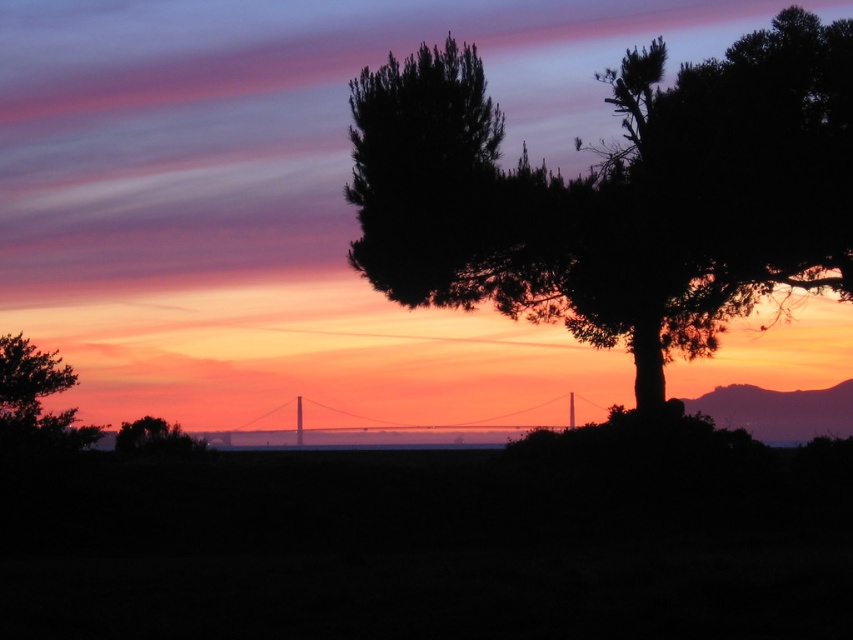
You are an artist sketching the sunset scene. You need to place the black silhouetted tree at upper right and the green matte tree at lower left in your drawing. According to the scene, which tree should you draw first to ensure proper spatial arrangement?

You should draw the green matte tree at lower left first because the black silhouetted tree at upper right is to the right of it, meaning the green matte tree at lower left is closer and should be placed first to maintain the correct spatial relationship.

You are an artist planning to paint this sunset scene. You want to ensure the black silhouetted tree at upper right and the metallic bridge at center are proportionally accurate. Based on the scene, which object should you paint narrower?

The black silhouetted tree at upper right should be painted narrower because its width is less than that of the metallic bridge at center.